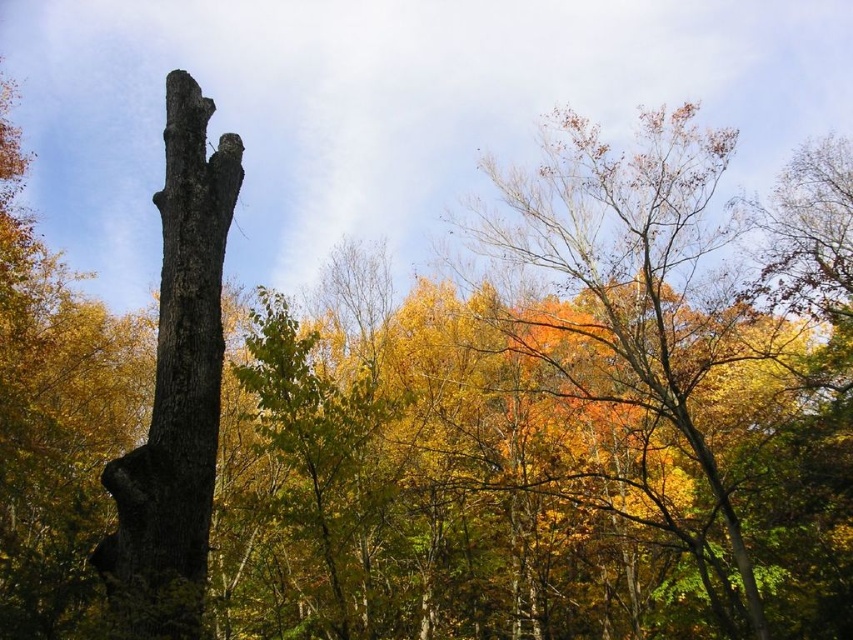
Question: Which object appears closest to the camera in this image?

Choices:
 (A) orange-brown bark tree at upper right
 (B) smooth bark tree trunk at left

Answer: (B)

Question: Among these objects, which one is farthest from the camera?

Choices:
 (A) orange-brown bark tree at upper right
 (B) smooth bark tree trunk at left

Answer: (A)

Question: Does orange-brown bark tree at upper right lie in front of smooth bark tree trunk at left?

Choices:
 (A) yes
 (B) no

Answer: (B)

Question: Which point appears closest to the camera in this image?

Choices:
 (A) (158, 612)
 (B) (651, 252)

Answer: (A)

Question: Does orange-brown bark tree at upper right have a larger size compared to smooth bark tree trunk at left?

Choices:
 (A) yes
 (B) no

Answer: (A)

Question: Can you confirm if orange-brown bark tree at upper right is smaller than smooth bark tree trunk at left?

Choices:
 (A) yes
 (B) no

Answer: (B)